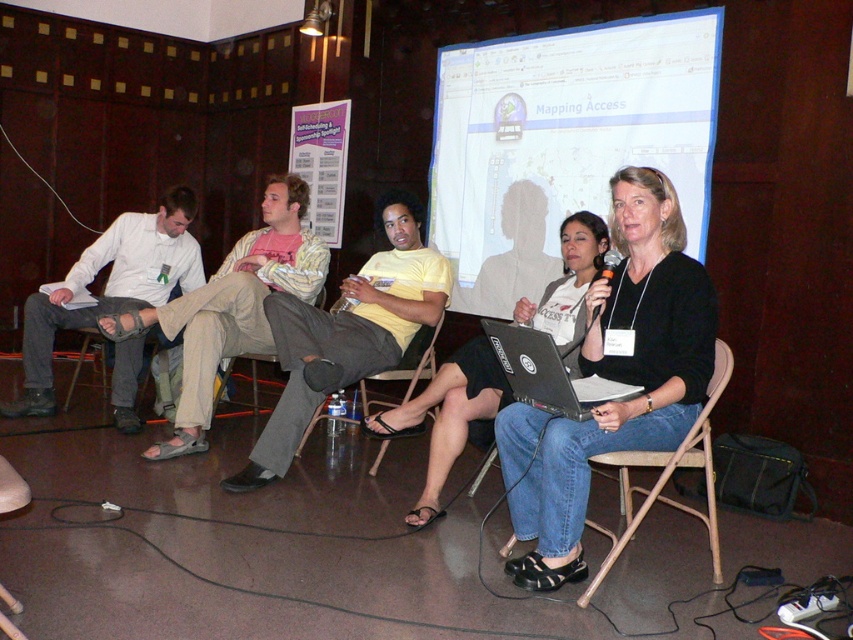
You are attending a presentation in the conference room and need to adjust the projector to ensure the image is centered on the white matte projection screen at upper center. Based on the coordinates provided, where should you position the projector relative to the screen?

The white matte projection screen at upper center is located at point (563, 141), so you should position the projector directly in front of this coordinate to center the image.

What is the location of the point at coordinates (563, 141) in the image?

The point at coordinates (563, 141) is on the white matte projection screen at upper center.